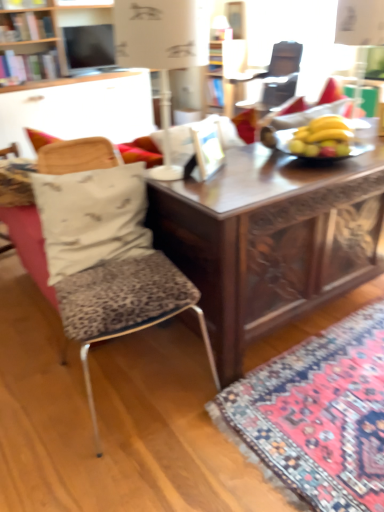
Question: Considering the relative sizes of matte black television at upper center and yellow matte bananas at center in the image provided, is matte black television at upper center bigger than yellow matte bananas at center?

Choices:
 (A) no
 (B) yes

Answer: (B)

Question: Is matte black television at upper center oriented away from yellow matte bananas at center?

Choices:
 (A) yes
 (B) no

Answer: (B)

Question: Is matte black television at upper center not near yellow matte bananas at center?

Choices:
 (A) yes
 (B) no

Answer: (A)

Question: From the image's perspective, does matte black television at upper center appear higher than yellow matte bananas at center?

Choices:
 (A) yes
 (B) no

Answer: (A)

Question: Is matte black television at upper center completely or partially outside of yellow matte bananas at center?

Choices:
 (A) yes
 (B) no

Answer: (A)

Question: Is white paper lampshade at upper center wider or thinner than wooden carved desk at center?

Choices:
 (A) wide
 (B) thin

Answer: (B)

Question: From the image's perspective, is white paper lampshade at upper center located above or below wooden carved desk at center?

Choices:
 (A) below
 (B) above

Answer: (B)

Question: From their relative heights in the image, would you say white paper lampshade at upper center is taller or shorter than wooden carved desk at center?

Choices:
 (A) short
 (B) tall

Answer: (A)

Question: Does point (168, 33) appear closer or farther from the camera than point (344, 181)?

Choices:
 (A) closer
 (B) farther

Answer: (A)

Question: Visually, is carpet with intricate patterns at lower right positioned to the left or to the right of wooden picture frame at center?

Choices:
 (A) left
 (B) right

Answer: (B)

Question: Is carpet with intricate patterns at lower right in front of or behind wooden picture frame at center in the image?

Choices:
 (A) behind
 (B) front

Answer: (B)

Question: From the image's perspective, is carpet with intricate patterns at lower right above or below wooden picture frame at center?

Choices:
 (A) above
 (B) below

Answer: (B)

Question: In terms of width, does carpet with intricate patterns at lower right look wider or thinner when compared to wooden picture frame at center?

Choices:
 (A) thin
 (B) wide

Answer: (B)

Question: In terms of size, does carpet with intricate patterns at lower right appear bigger or smaller than wooden carved desk at center?

Choices:
 (A) big
 (B) small

Answer: (B)

Question: Considering the positions of carpet with intricate patterns at lower right and wooden carved desk at center in the image, is carpet with intricate patterns at lower right wider or thinner than wooden carved desk at center?

Choices:
 (A) wide
 (B) thin

Answer: (A)